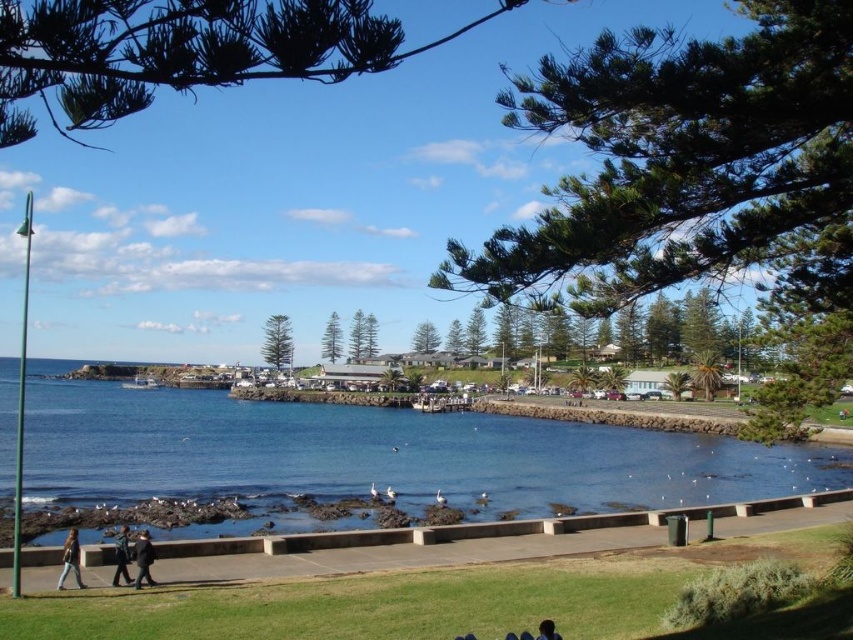
You are standing at the point with coordinates point [126,566] and want to walk to the point with coordinates point [544,620]. Which direction should you face to walk towards your destination?

You should face northeast to walk towards point [544,620] from point [126,566].

You are standing at the origin point of the image, which is the bottom left corner. You want to move towards the dark blue jeans at lower left. What direction should you move in?

Since the dark blue jeans at lower left is located at point 0.869 on the x axis and 0.143 on the y axis, you should move towards the right and slightly upwards from the origin point to reach it.

You are a photographer standing at the shoreline. You want to take a photo that includes both the dark gray jacket at lower left and the brown hair at lower center. Given that your camera has a maximum zoom range of 8 meters, will you be able to capture both subjects in the same frame without moving closer?

The dark gray jacket at lower left and brown hair at lower center are 10.55 meters apart. Since the camera can only zoom up to 8 meters, the subjects are beyond the maximum zoom range. Therefore, you will not be able to capture both in the same frame without moving closer.